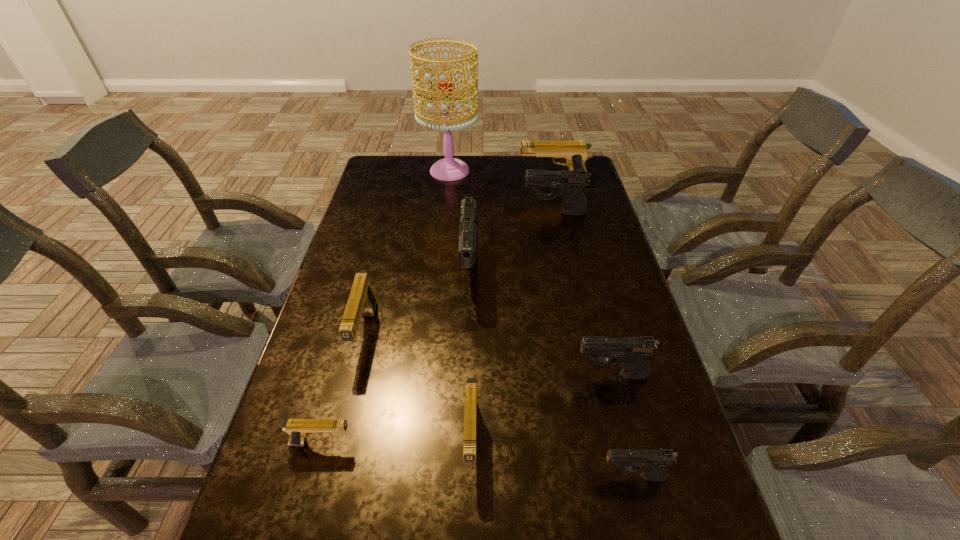
Locate an element on the screen. the nearest black pistol is located at coordinates (654, 463).

Identify the location of the shortest pistol. Image resolution: width=960 pixels, height=540 pixels. tap(298, 429).

The width and height of the screenshot is (960, 540). I want to click on the shortest object, so click(x=298, y=429).

The height and width of the screenshot is (540, 960). Find the location of `vacant space located on the front of the lampshade`. vacant space located on the front of the lampshade is located at coordinates (446, 201).

Where is `blank area located 0.260m at the barrel of the second farthest black pistol`? The width and height of the screenshot is (960, 540). blank area located 0.260m at the barrel of the second farthest black pistol is located at coordinates (468, 384).

Find the location of a particular element. The width and height of the screenshot is (960, 540). vacant region located 0.280m at the barrel of the farthest pistol is located at coordinates (445, 183).

Image resolution: width=960 pixels, height=540 pixels. Find the location of `free space located 0.050m at the barrel of the farthest pistol`. free space located 0.050m at the barrel of the farthest pistol is located at coordinates (505, 183).

At what (x,y) coordinates should I click in order to perform the action: click on free space located at the barrel of the farthest pistol. Please return your answer as a coordinate pair (x, y). Looking at the image, I should click on (x=497, y=183).

At what (x,y) coordinates should I click in order to perform the action: click on free location located at the barrel of the third smallest black pistol. Please return your answer as a coordinate pair (x, y). This screenshot has height=540, width=960. Looking at the image, I should click on (449, 213).

This screenshot has width=960, height=540. I want to click on free location located 0.310m at the barrel of the third smallest black pistol, so click(435, 213).